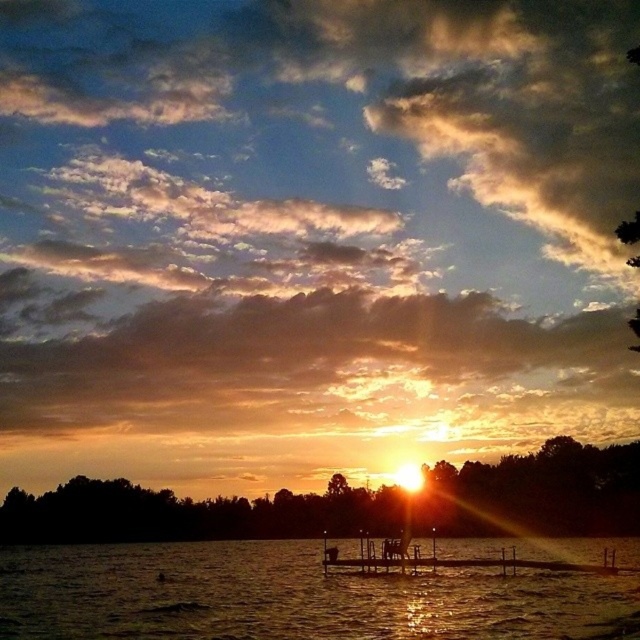
Question: Is shiny metallic water at lower center below brown wooden dock at center?

Choices:
 (A) no
 (B) yes

Answer: (A)

Question: Which object appears closest to the camera in this image?

Choices:
 (A) brown wooden dock at center
 (B) shiny metallic water at lower center

Answer: (B)

Question: Considering the relative positions of shiny metallic water at lower center and brown wooden dock at center in the image provided, where is shiny metallic water at lower center located with respect to brown wooden dock at center?

Choices:
 (A) right
 (B) left

Answer: (B)

Question: Which of the following is the farthest from the observer?

Choices:
 (A) shiny metallic water at lower center
 (B) brown wooden dock at center

Answer: (B)

Question: Does shiny metallic water at lower center lie behind brown wooden dock at center?

Choices:
 (A) no
 (B) yes

Answer: (A)